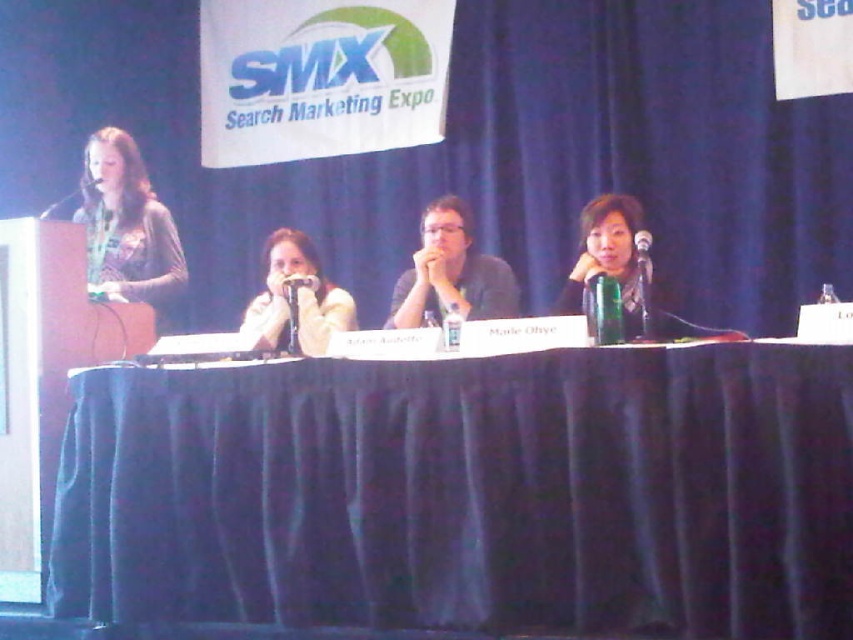
You are a photographer at the event and need to capture a closeup of the matte black hair at right and the black plastic microphone at upper center. Which object will appear wider in the photo?

The matte black hair at right will appear wider in the photo since its width is larger than the black plastic microphone at upper center.

You are attending the SMX Search Marketing Expo and notice a panelist with matte black hair at right. Can you determine their exact position relative to the stage based on the coordinates provided?

The matte black hair at right is positioned at coordinates point (608, 257), which indicates their location on the stage.

You are a photographer at the back of the stage. You want to take a photo of the black plastic microphone at upper center without the matte black hair at right blocking it. What should you do?

The matte black hair at right is further to the viewer than the black plastic microphone at upper center, so you should move your position to the left to avoid the obstruction.